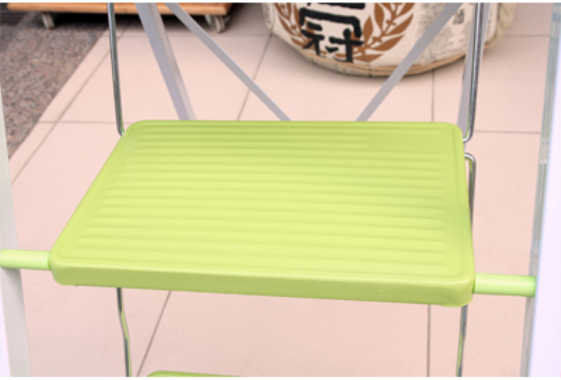
This screenshot has width=561, height=380. I want to click on lime green plastic chair, so click(x=409, y=242).